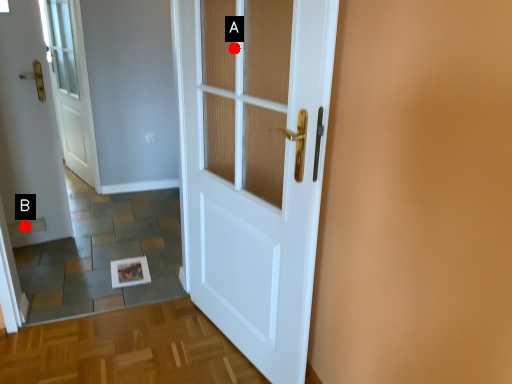
Question: Two points are circled on the image, labeled by A and B beside each circle. Which point is closer to the camera?

Choices:
 (A) A is closer
 (B) B is closer

Answer: (A)